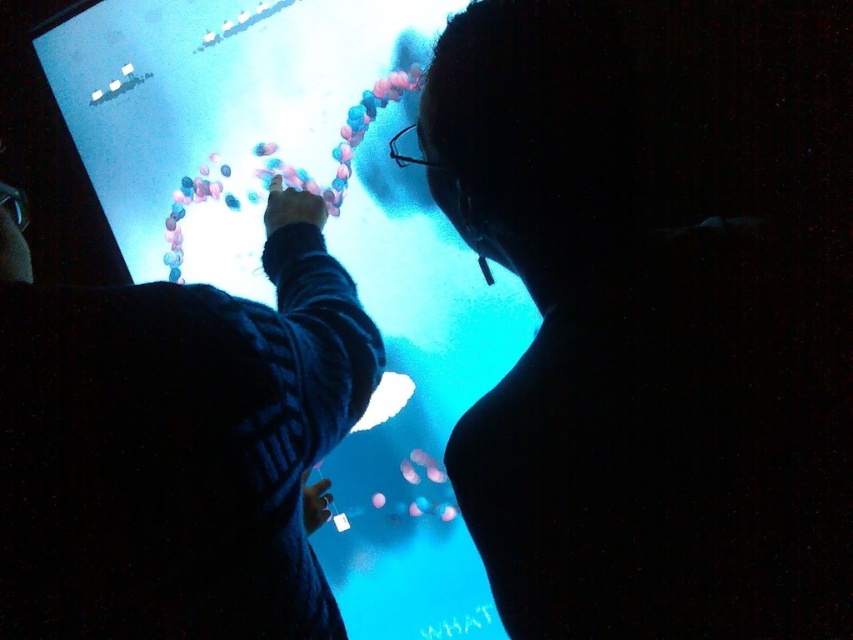
You are an observer in the room. You see the silhouette face at upper center and the dark blue sweater at upper center. Which object is positioned more to the right?

The silhouette face at upper center is positioned more to the right than the dark blue sweater at upper center.